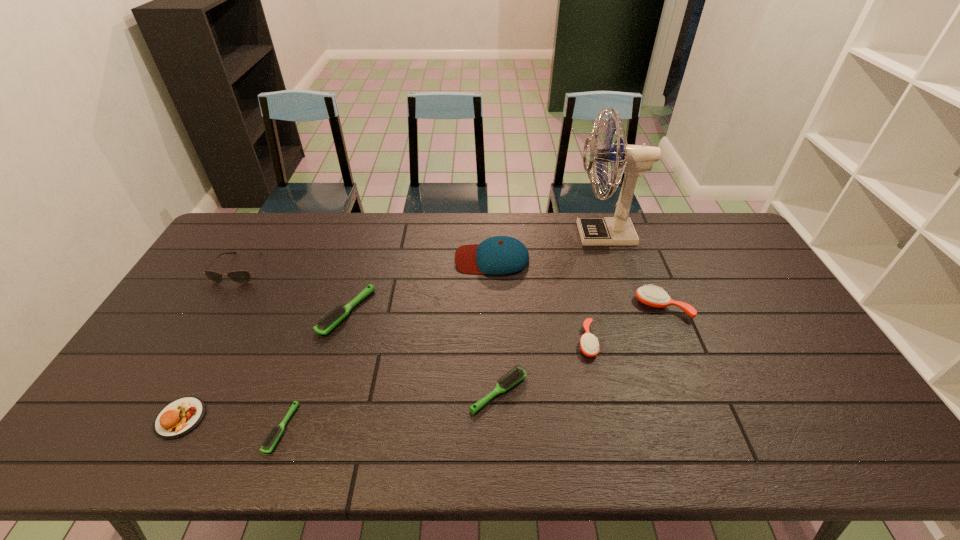
Identify the location of hairbrush that is at the near edge. (269, 442).

This screenshot has width=960, height=540. I want to click on sunglasses present at the left edge, so click(242, 276).

At what (x,y) coordinates should I click in order to perform the action: click on patty (food) that is positioned at the left edge. Please return your answer as a coordinate pair (x, y). Image resolution: width=960 pixels, height=540 pixels. Looking at the image, I should click on [x=179, y=417].

Locate an element on the screen. object present at the near left corner is located at coordinates (179, 417).

In the image, there is a desktop. At what (x,y) coordinates should I click in order to perform the action: click on free space at the far edge. Please return your answer as a coordinate pair (x, y). Looking at the image, I should click on (522, 239).

Identify the location of free space at the near edge of the desktop. The height and width of the screenshot is (540, 960). (227, 461).

Locate an element on the screen. This screenshot has height=540, width=960. free region at the left edge of the desktop is located at coordinates (185, 343).

The image size is (960, 540). In the image, there is a desktop. In order to click on vacant space at the right edge in this screenshot , I will do tap(725, 260).

The width and height of the screenshot is (960, 540). I want to click on vacant space that is in between the patty (food) and the farther orange hairbrush, so click(421, 362).

In order to click on free space between the fan and the tallest hairbrush in this screenshot , I will do `click(634, 271)`.